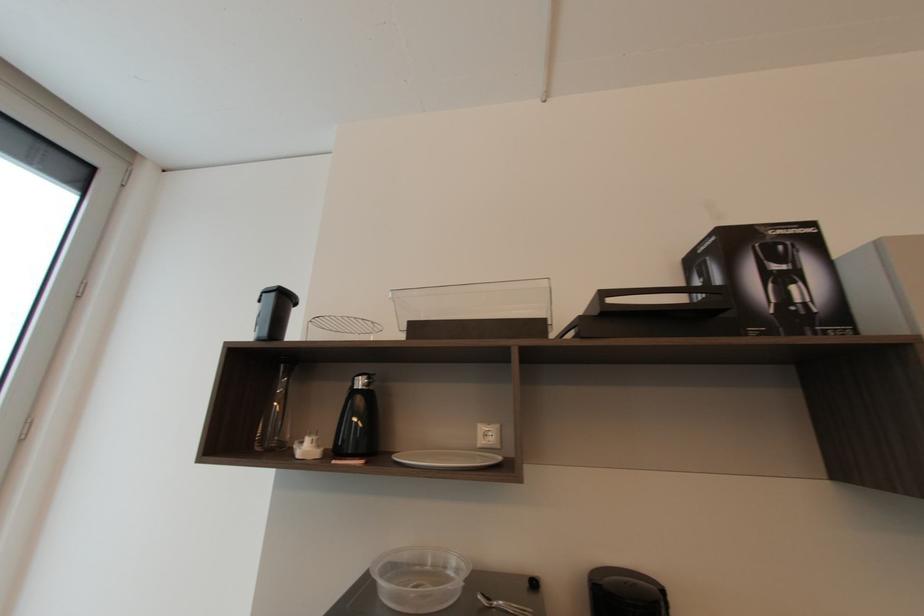
The image size is (924, 616). What are the coordinates of `black kettle lid` in the screenshot? It's located at (625, 593).